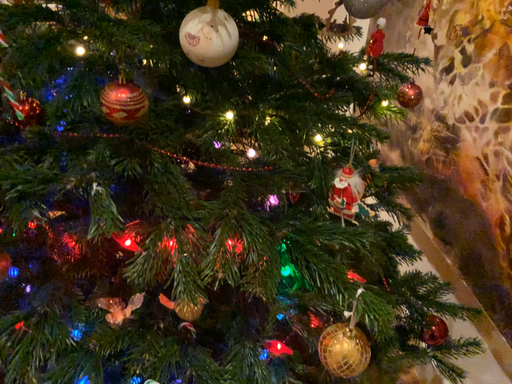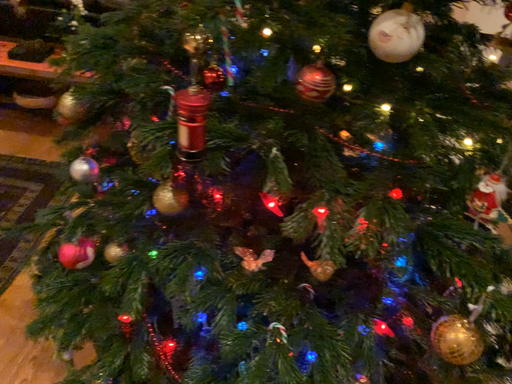
Question: Which way did the camera rotate in the video?

Choices:
 (A) rotated left
 (B) rotated right

Answer: (A)